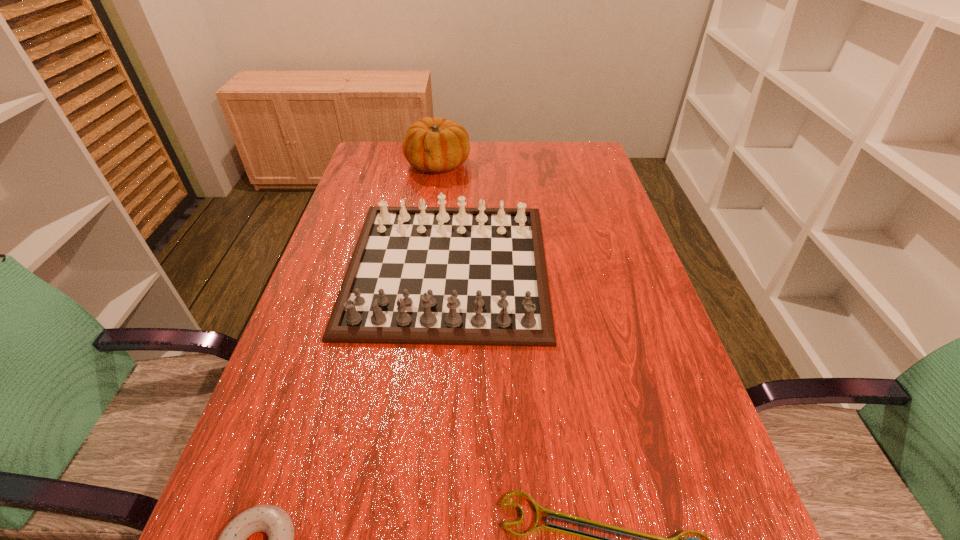
At what (x,y) coordinates should I click in order to perform the action: click on the tallest object. Please return your answer as a coordinate pair (x, y). Image resolution: width=960 pixels, height=540 pixels. Looking at the image, I should click on (435, 144).

The image size is (960, 540). Identify the location of gourd. (435, 144).

I want to click on the third nearest object, so click(422, 275).

Image resolution: width=960 pixels, height=540 pixels. I want to click on chessboard, so click(422, 275).

I want to click on vacant area located on the front of the tallest object, so click(x=429, y=232).

Locate an element on the screen. vacant space situated 0.170m on the right of the second farthest object is located at coordinates (618, 267).

Identify the location of object that is positioned at the far edge. (435, 144).

Identify the location of gourd present at the left edge. (435, 144).

You are a GUI agent. You are given a task and a screenshot of the screen. Output one action in this format:
    pyautogui.click(x=<x>, y=<y>)
    Task: Click on the chessboard that is positioned at the left edge
    This screenshot has width=960, height=540.
    Given the screenshot: What is the action you would take?
    pyautogui.click(x=422, y=275)

The image size is (960, 540). I want to click on object located at the far left corner, so click(x=435, y=144).